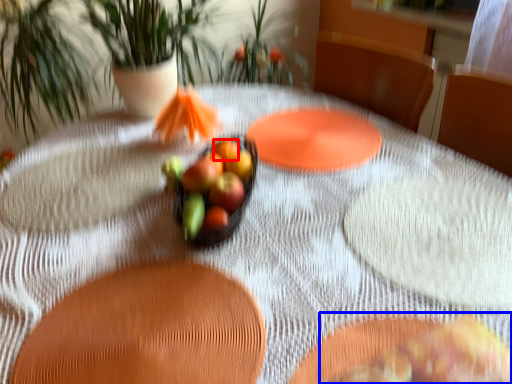
Question: Which object is further to the camera taking this photo, fruit (highlighted by a red box) or food (highlighted by a blue box)?

Choices:
 (A) fruit
 (B) food

Answer: (A)